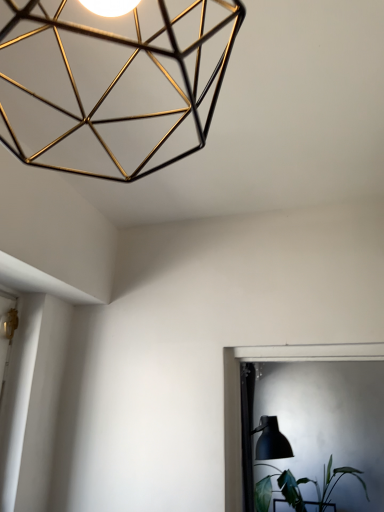
Question: Considering the relative positions of green leafy plant at lower right and matte black table lamp at lower right in the image provided, is green leafy plant at lower right behind matte black table lamp at lower right?

Choices:
 (A) no
 (B) yes

Answer: (B)

Question: Is green leafy plant at lower right shorter than matte black table lamp at lower right?

Choices:
 (A) no
 (B) yes

Answer: (B)

Question: Would you say green leafy plant at lower right is outside matte black table lamp at lower right?

Choices:
 (A) no
 (B) yes

Answer: (B)

Question: Is the position of green leafy plant at lower right less distant than that of matte black table lamp at lower right?

Choices:
 (A) yes
 (B) no

Answer: (B)

Question: Is green leafy plant at lower right at the left side of matte black table lamp at lower right?

Choices:
 (A) yes
 (B) no

Answer: (B)

Question: Relative to green leafy plant at lower right, is matte black table lamp at lower right in front or behind?

Choices:
 (A) front
 (B) behind

Answer: (A)

Question: In terms of width, does matte black table lamp at lower right look wider or thinner when compared to green leafy plant at lower right?

Choices:
 (A) wide
 (B) thin

Answer: (B)

Question: From a real-world perspective, relative to green leafy plant at lower right, is matte black table lamp at lower right vertically above or below?

Choices:
 (A) above
 (B) below

Answer: (A)

Question: Do you think matte black table lamp at lower right is within green leafy plant at lower right, or outside of it?

Choices:
 (A) outside
 (B) inside

Answer: (A)

Question: Considering the relative positions of matte black table lamp at lower right and gold wireframe lamp at upper left in the image provided, is matte black table lamp at lower right to the left or to the right of gold wireframe lamp at upper left?

Choices:
 (A) left
 (B) right

Answer: (B)

Question: Looking at the image, does matte black table lamp at lower right seem bigger or smaller compared to gold wireframe lamp at upper left?

Choices:
 (A) small
 (B) big

Answer: (B)

Question: Do you think matte black table lamp at lower right is within gold wireframe lamp at upper left, or outside of it?

Choices:
 (A) inside
 (B) outside

Answer: (B)

Question: In the image, is matte black table lamp at lower right positioned in front of or behind gold wireframe lamp at upper left?

Choices:
 (A) behind
 (B) front

Answer: (A)

Question: Is point (x=205, y=34) closer or farther from the camera than point (x=271, y=444)?

Choices:
 (A) closer
 (B) farther

Answer: (A)

Question: From the image's perspective, is gold wireframe lamp at upper left above or below matte black table lamp at lower right?

Choices:
 (A) above
 (B) below

Answer: (A)